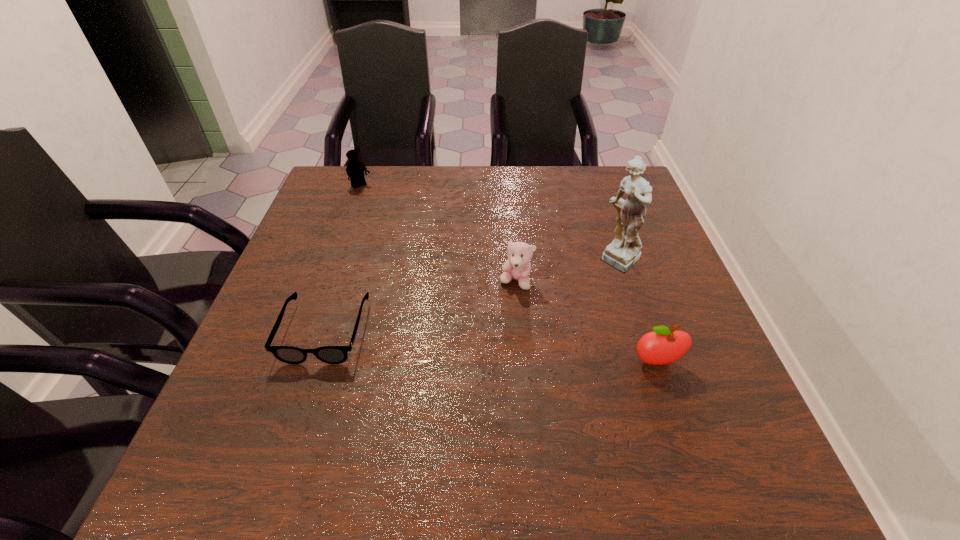
Locate an element on the screen. The width and height of the screenshot is (960, 540). the fourth closest object to the apple is located at coordinates (355, 169).